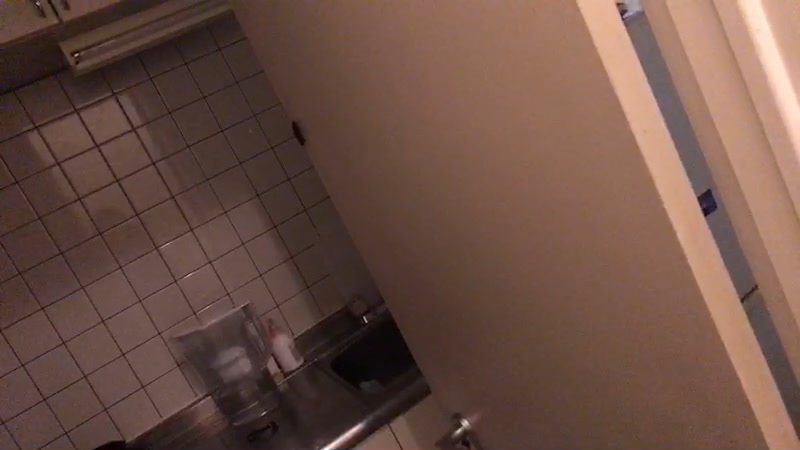
I want to click on countertop, so click(324, 401).